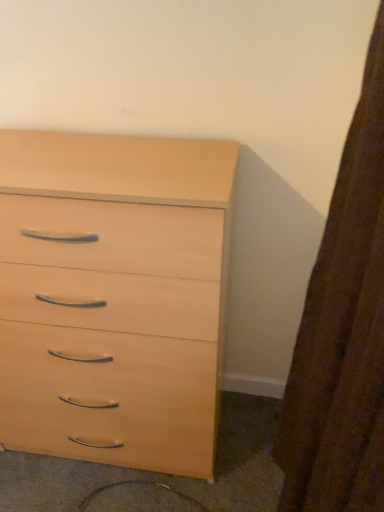
Question: Can you confirm if brown textured curtain at right is shorter than light wood chest of drawers at center?

Choices:
 (A) yes
 (B) no

Answer: (A)

Question: From a real-world perspective, is brown textured curtain at right beneath light wood chest of drawers at center?

Choices:
 (A) yes
 (B) no

Answer: (B)

Question: Is brown textured curtain at right at the left side of light wood chest of drawers at center?

Choices:
 (A) no
 (B) yes

Answer: (A)

Question: From a real-world perspective, is brown textured curtain at right on top of light wood chest of drawers at center?

Choices:
 (A) yes
 (B) no

Answer: (A)

Question: Is brown textured curtain at right taller than light wood chest of drawers at center?

Choices:
 (A) yes
 (B) no

Answer: (B)

Question: Is brown textured curtain at right at the right side of light wood chest of drawers at center?

Choices:
 (A) yes
 (B) no

Answer: (A)

Question: Is light wood drawer at lower center smaller than brown textured curtain at right?

Choices:
 (A) yes
 (B) no

Answer: (A)

Question: Can you confirm if light wood drawer at lower center is positioned to the right of brown textured curtain at right?

Choices:
 (A) no
 (B) yes

Answer: (A)

Question: Is light wood drawer at lower center in front of brown textured curtain at right?

Choices:
 (A) no
 (B) yes

Answer: (A)

Question: Is light wood drawer at lower center shorter than brown textured curtain at right?

Choices:
 (A) no
 (B) yes

Answer: (B)

Question: Is brown textured curtain at right inside light wood drawer at lower center?

Choices:
 (A) no
 (B) yes

Answer: (A)

Question: Considering the relative sizes of light wood drawer at lower center and brown textured curtain at right in the image provided, is light wood drawer at lower center bigger than brown textured curtain at right?

Choices:
 (A) no
 (B) yes

Answer: (A)

Question: Is light wood drawer at lower center bigger than light wood chest of drawers at center?

Choices:
 (A) yes
 (B) no

Answer: (B)